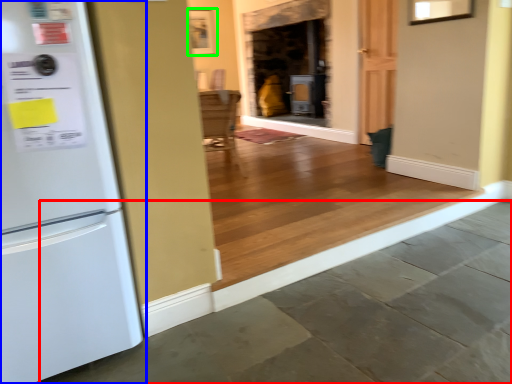
Question: Based on their relative distances, which object is nearer to concrete (highlighted by a red box)? Choose from refrigerator (highlighted by a blue box) and picture frame (highlighted by a green box).

Choices:
 (A) refrigerator
 (B) picture frame

Answer: (A)